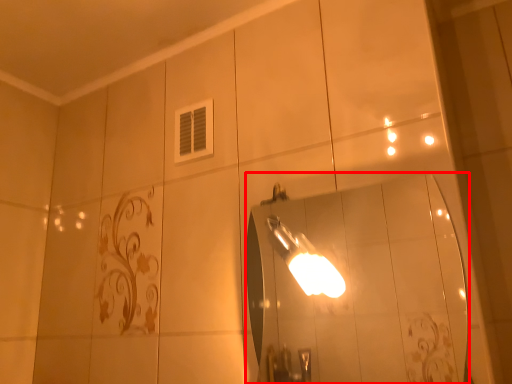
Question: Observing the image, what is the correct spatial positioning of mirror (annotated by the red box) in reference to light fixture?

Choices:
 (A) right
 (B) left

Answer: (A)